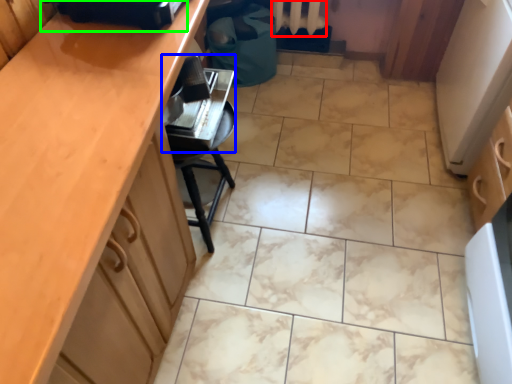
Question: Estimate the real-world distances between objects in this image. Which object is farther from radiator (highlighted by a red box), appliance (highlighted by a blue box) or appliance (highlighted by a green box)?

Choices:
 (A) appliance
 (B) appliance

Answer: (B)